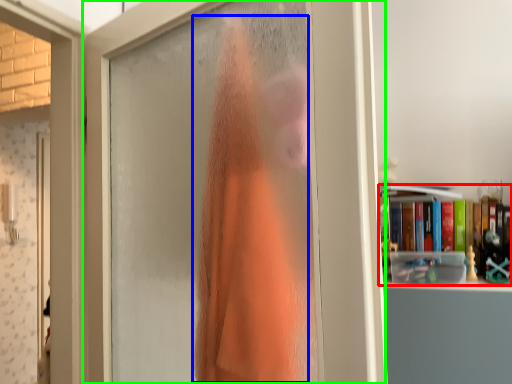
Question: Estimate the real-world distances between objects in this image. Which object is closer to book (highlighted by a red box), clothing (highlighted by a blue box) or door (highlighted by a green box)?

Choices:
 (A) clothing
 (B) door

Answer: (A)